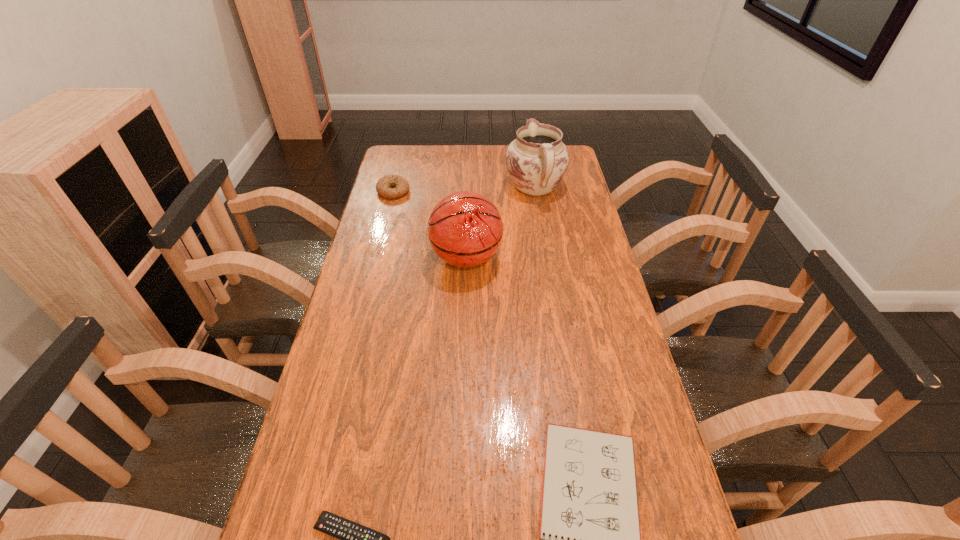
Where is `object situated at the left edge`? This screenshot has height=540, width=960. object situated at the left edge is located at coordinates (383, 185).

Locate an element on the screen. The width and height of the screenshot is (960, 540). object situated at the right edge is located at coordinates (537, 160).

Find the location of a particular element. The height and width of the screenshot is (540, 960). object that is positioned at the far right corner is located at coordinates (537, 160).

Where is `vacant space at the far edge of the desktop`? vacant space at the far edge of the desktop is located at coordinates (444, 171).

You are a GUI agent. You are given a task and a screenshot of the screen. Output one action in this format:
    pyautogui.click(x=<x>, y=<y>)
    Task: Click on the vacant region at the left edge of the desktop
    This screenshot has height=540, width=960.
    Given the screenshot: What is the action you would take?
    pyautogui.click(x=341, y=404)

In the image, there is a desktop. Where is `vacant space at the right edge`? This screenshot has height=540, width=960. vacant space at the right edge is located at coordinates (570, 270).

Where is `blank space at the far left corner of the desktop`? This screenshot has height=540, width=960. blank space at the far left corner of the desktop is located at coordinates (403, 154).

Identify which object is the fourth nearest to the bagel. Please provide its 2D coordinates. Your answer should be formatted as a tuple, i.e. [(x, y)], where the tuple contains the x and y coordinates of a point satisfying the conditions above.

[(355, 539)]

Identify which object is the third closest to the bagel. Please provide its 2D coordinates. Your answer should be formatted as a tuple, i.e. [(x, y)], where the tuple contains the x and y coordinates of a point satisfying the conditions above.

[(590, 539)]